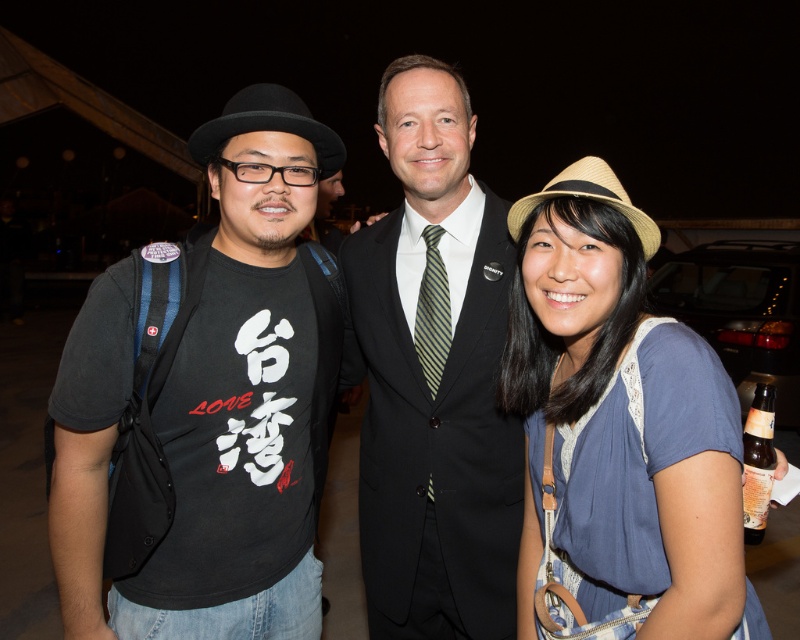
In the scene shown: Can you confirm if black felt fedora at left is positioned to the left of striped silk tie at center?

Yes, black felt fedora at left is to the left of striped silk tie at center.

Is black felt fedora at left bigger than striped silk tie at center?

Yes.

Find the location of a particular element. black felt fedora at left is located at coordinates (268, 125).

Locate an element on the screen. black felt fedora at left is located at coordinates point(268,125).

Is black felt fedora at left below brown glass bottle at lower right?

Incorrect, black felt fedora at left is not positioned below brown glass bottle at lower right.

Which is in front, point (284, 116) or point (750, 483)?

Point (284, 116) is in front.

Identify the location of black felt fedora at left. This screenshot has height=640, width=800. (268, 125).

Is black matte t-shirt at left closer to camera compared to black suit at center?

Yes, black matte t-shirt at left is in front of black suit at center.

Is point (88, 534) closer to viewer compared to point (390, 625)?

Yes, it is in front of point (390, 625).

I want to click on black matte t-shirt at left, so click(214, 403).